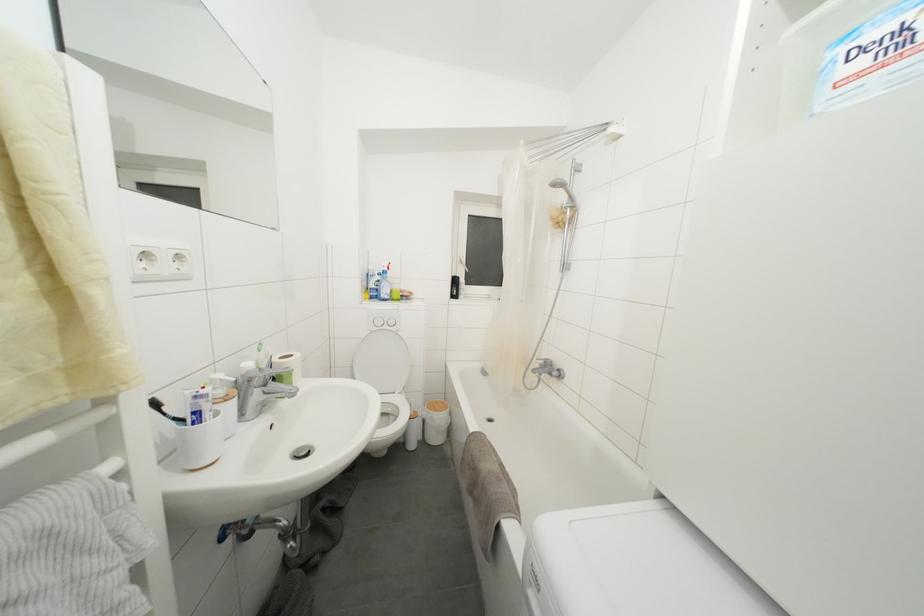
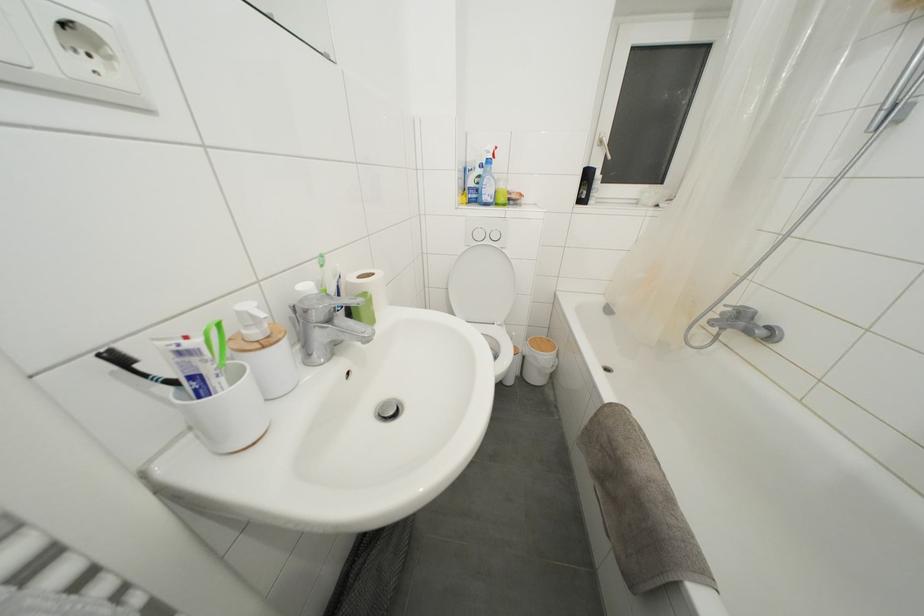
The first image is from the beginning of the video and the second image is from the end. How did the camera likely rotate when shooting the video?

The rotation direction of the camera is left-down.